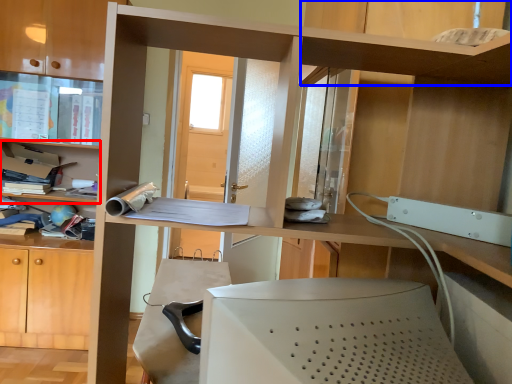
Question: Which of the following is the farthest to the observer, shelf (highlighted by a red box) or shelf (highlighted by a blue box)?

Choices:
 (A) shelf
 (B) shelf

Answer: (A)